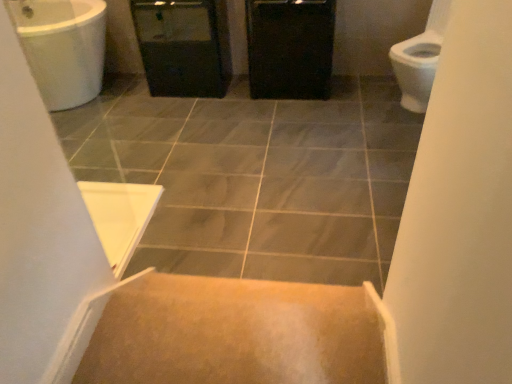
What do you see at coordinates (184, 46) in the screenshot? This screenshot has height=384, width=512. I see `black plastic screen door at center` at bounding box center [184, 46].

What are the coordinates of `black plastic screen door at center` in the screenshot? It's located at (184, 46).

I want to click on gray tile at center, so click(257, 178).

Where is `black matte cabinet at center`? This screenshot has width=512, height=384. black matte cabinet at center is located at coordinates (290, 48).

Locate an element on the screen. cabinetry above the carpeted stairs at center (from the image's perspective) is located at coordinates (290, 48).

Which object is wider, carpeted stairs at center or black matte cabinet at center?

black matte cabinet at center.

Does carpeted stairs at center have a smaller size compared to black matte cabinet at center?

Yes.

Are carpeted stairs at center and black matte cabinet at center far apart?

That's right, there is a large distance between carpeted stairs at center and black matte cabinet at center.

Who is shorter, black plastic screen door at center or carpeted stairs at center?

With less height is carpeted stairs at center.

Considering the relative positions of black plastic screen door at center and carpeted stairs at center in the image provided, is black plastic screen door at center to the left of carpeted stairs at center from the viewer's perspective?

Yes.

Consider the image. Is black plastic screen door at center beside carpeted stairs at center?

No.

Is black matte cabinet at center located outside gray tile at center?

Indeed, black matte cabinet at center is completely outside gray tile at center.

In the scene shown: Can you confirm if black matte cabinet at center is taller than gray tile at center?

Indeed, black matte cabinet at center has a greater height compared to gray tile at center.

Is point (309, 20) closer or farther from the camera than point (72, 149)?

Point (309, 20) appears to be closer to the viewer than point (72, 149).

Is black matte cabinet at center oriented away from carpeted stairs at center?

black matte cabinet at center is not turned away from carpeted stairs at center.

From a real-world perspective, is black matte cabinet at center physically above carpeted stairs at center?

Incorrect, from a real-world perspective, black matte cabinet at center is lower than carpeted stairs at center.

Identify the location of cabinetry below the carpeted stairs at center (from a real-world perspective). (290, 48).

Is black matte cabinet at center not within carpeted stairs at center?

Yes, black matte cabinet at center is outside of carpeted stairs at center.

Is carpeted stairs at center aimed at black plastic screen door at center?

Yes, carpeted stairs at center faces towards black plastic screen door at center.

From a real-world perspective, relative to black plastic screen door at center, is carpeted stairs at center vertically above or below?

carpeted stairs at center is situated higher than black plastic screen door at center in the real world.

Considering the sizes of objects carpeted stairs at center and black plastic screen door at center in the image provided, who is shorter, carpeted stairs at center or black plastic screen door at center?

With less height is carpeted stairs at center.

Is the depth of carpeted stairs at center greater than that of black plastic screen door at center?

No, carpeted stairs at center is in front of black plastic screen door at center.

From the image's perspective, is gray tile at center positioned above or below carpeted stairs at center?

Clearly, from the image's perspective, gray tile at center is above carpeted stairs at center.

Identify the location of stairs on the right of gray tile at center. The width and height of the screenshot is (512, 384). (234, 333).

Considering the relative positions of gray tile at center and carpeted stairs at center in the image provided, is gray tile at center to the left of carpeted stairs at center from the viewer's perspective?

Correct, you'll find gray tile at center to the left of carpeted stairs at center.

Can you tell me how much gray tile at center and carpeted stairs at center differ in facing direction?

The angular difference between gray tile at center and carpeted stairs at center is 180 degrees.

Does point (265, 336) lie in front of point (93, 129)?

That is True.

Is carpeted stairs at center thinner than gray tile at center?

Indeed, carpeted stairs at center has a lesser width compared to gray tile at center.

Find the location of a particular element. ceramic tile located behind the carpeted stairs at center is located at coordinates (257, 178).

Where is `cabinetry located underneath the carpeted stairs at center (from a real-world perspective)`? The width and height of the screenshot is (512, 384). cabinetry located underneath the carpeted stairs at center (from a real-world perspective) is located at coordinates (290, 48).

This screenshot has width=512, height=384. I want to click on screen door behind the carpeted stairs at center, so click(184, 46).

Looking at this image, from the image, which object appears to be farther from black plastic screen door at center, carpeted stairs at center or gray tile at center?

The object further to black plastic screen door at center is carpeted stairs at center.

Looking at the image, which one is located closer to black matte cabinet at center, gray tile at center or black plastic screen door at center?

black plastic screen door at center is positioned closer to the anchor black matte cabinet at center.

Estimate the real-world distances between objects in this image. Which object is closer to black plastic screen door at center, gray tile at center or black matte cabinet at center?

black matte cabinet at center is closer to black plastic screen door at center.

Considering their positions, is gray tile at center positioned further to black plastic screen door at center than carpeted stairs at center?

The object further to black plastic screen door at center is carpeted stairs at center.

Which object lies nearer to the anchor point gray tile at center, black matte cabinet at center or black plastic screen door at center?

Among the two, black matte cabinet at center is located nearer to gray tile at center.

Based on their spatial positions, is carpeted stairs at center or gray tile at center closer to black matte cabinet at center?

gray tile at center is positioned closer to the anchor black matte cabinet at center.

Considering their positions, is black plastic screen door at center positioned closer to black matte cabinet at center than carpeted stairs at center?

black plastic screen door at center.

Estimate the real-world distances between objects in this image. Which object is further from black plastic screen door at center, carpeted stairs at center or black matte cabinet at center?

The object further to black plastic screen door at center is carpeted stairs at center.

You are a GUI agent. You are given a task and a screenshot of the screen. Output one action in this format:
    pyautogui.click(x=<x>, y=<y>)
    Task: Click on the ceramic tile positioned between carpeted stairs at center and black matte cabinet at center from near to far
    The image size is (512, 384).
    Given the screenshot: What is the action you would take?
    pyautogui.click(x=257, y=178)

Image resolution: width=512 pixels, height=384 pixels. Find the location of `cabinetry between carpeted stairs at center and black plastic screen door at center in the front-back direction`. cabinetry between carpeted stairs at center and black plastic screen door at center in the front-back direction is located at coordinates (290, 48).

You are a GUI agent. You are given a task and a screenshot of the screen. Output one action in this format:
    pyautogui.click(x=<x>, y=<y>)
    Task: Click on the ceramic tile positioned between carpeted stairs at center and black plastic screen door at center from near to far
    Image resolution: width=512 pixels, height=384 pixels.
    Given the screenshot: What is the action you would take?
    pyautogui.click(x=257, y=178)

Where is `cabinetry between gray tile at center and black plastic screen door at center in the front-back direction`? cabinetry between gray tile at center and black plastic screen door at center in the front-back direction is located at coordinates (290, 48).